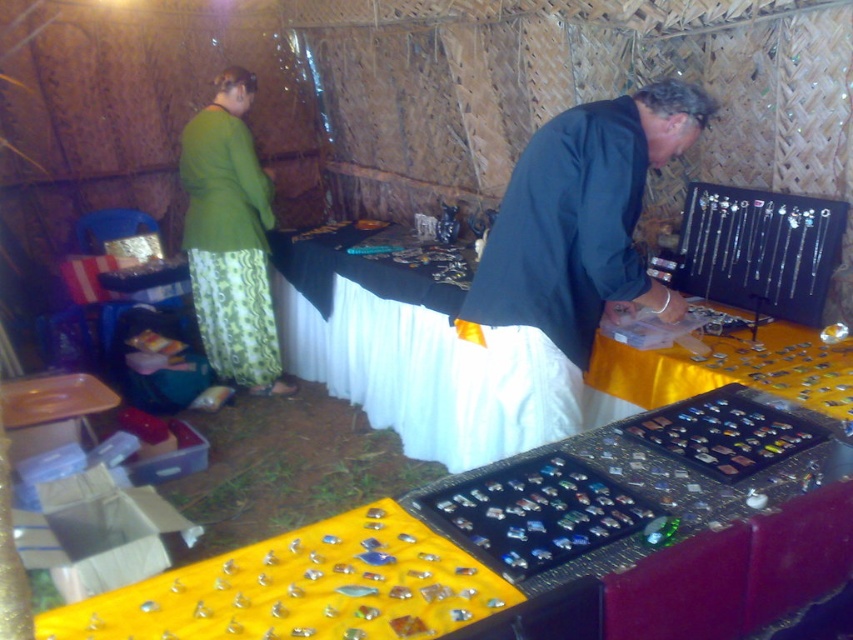
Which is in front, point (247, 624) or point (238, 141)?

Point (247, 624) is in front.

From the picture: Can you confirm if yellow fabric at center is smaller than green fabric skirt at left?

Incorrect, yellow fabric at center is not smaller in size than green fabric skirt at left.

Where is `yellow fabric at center`? The width and height of the screenshot is (853, 640). yellow fabric at center is located at coordinates (543, 545).

Locate an element on the screen. Image resolution: width=853 pixels, height=640 pixels. yellow fabric at center is located at coordinates (543, 545).

Between yellow fabric at center and dark green fabric at center, which one is positioned higher?

dark green fabric at center is higher up.

Is point (36, 621) less distant than point (483, 352)?

Yes, point (36, 621) is in front of point (483, 352).

The width and height of the screenshot is (853, 640). I want to click on yellow fabric at center, so click(x=543, y=545).

Is dark green fabric at center thinner than green fabric skirt at left?

Incorrect, dark green fabric at center's width is not less than green fabric skirt at left's.

Which is below, dark green fabric at center or green fabric skirt at left?

dark green fabric at center is below.

Locate an element on the screen. dark green fabric at center is located at coordinates (563, 264).